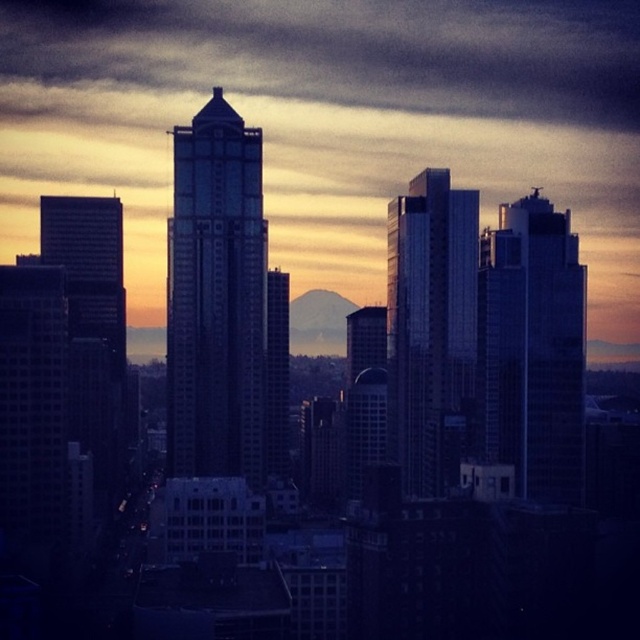
Is sleek glass skyscraper at right positioned behind glossy glass skyscraper at center?

Yes, sleek glass skyscraper at right is behind glossy glass skyscraper at center.

At what (x,y) coordinates should I click in order to perform the action: click on sleek glass skyscraper at right. Please return your answer as a coordinate pair (x, y). The image size is (640, 640). Looking at the image, I should click on (532, 348).

Locate an element on the screen. Image resolution: width=640 pixels, height=640 pixels. sleek glass skyscraper at right is located at coordinates (532, 348).

Does glassy reflective skyscraper at center appear on the left side of glossy glass skyscraper at center?

Indeed, glassy reflective skyscraper at center is positioned on the left side of glossy glass skyscraper at center.

Is point (228, 376) less distant than point (476, 230)?

Yes.

The image size is (640, 640). Find the location of `glassy reflective skyscraper at center`. glassy reflective skyscraper at center is located at coordinates (216, 298).

Image resolution: width=640 pixels, height=640 pixels. Describe the element at coordinates (216, 298) in the screenshot. I see `glassy reflective skyscraper at center` at that location.

Can you confirm if glassy reflective skyscraper at center is positioned below sleek glass skyscraper at right?

No, glassy reflective skyscraper at center is not below sleek glass skyscraper at right.

Is point (212, 412) positioned after point (582, 339)?

No.

At what (x,y) coordinates should I click in order to perform the action: click on glassy reflective skyscraper at center. Please return your answer as a coordinate pair (x, y). Looking at the image, I should click on (216, 298).